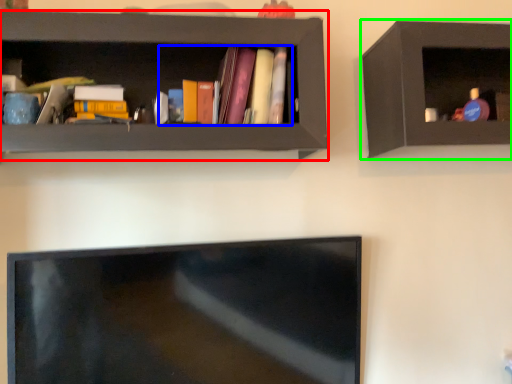
Question: Based on their relative distances, which object is farther from shelf (highlighted by a red box)? Choose from book (highlighted by a blue box) and shelf (highlighted by a green box).

Choices:
 (A) book
 (B) shelf

Answer: (B)